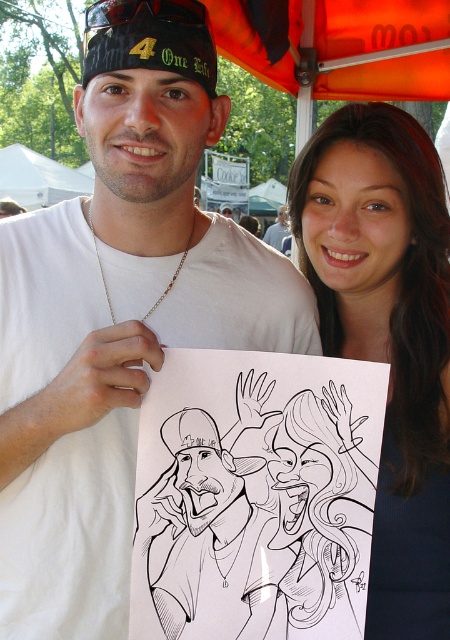
Which of these two, white matte t-shirt at center or orange fabric canopy at upper center, stands shorter?

With less height is orange fabric canopy at upper center.

How distant is white matte t-shirt at center from orange fabric canopy at upper center?

The distance of white matte t-shirt at center from orange fabric canopy at upper center is 4.80 feet.

At what (x,y) coordinates should I click in order to perform the action: click on white matte t-shirt at center. Please return your answer as a coordinate pair (x, y). Looking at the image, I should click on (117, 314).

Identify the location of white matte t-shirt at center. (117, 314).

Is black line drawing at center smaller than orange fabric canopy at upper center?

Correct, black line drawing at center occupies less space than orange fabric canopy at upper center.

How far apart are black line drawing at center and orange fabric canopy at upper center?

The distance of black line drawing at center from orange fabric canopy at upper center is 1.78 meters.

Between point (237, 620) and point (202, 1), which one is positioned behind?

The point (202, 1) is behind.

Locate an element on the screen. Image resolution: width=450 pixels, height=640 pixels. black line drawing at center is located at coordinates (256, 496).

Does white matte t-shirt at center have a smaller size compared to smooth dark hair at center?

Actually, white matte t-shirt at center might be larger than smooth dark hair at center.

What do you see at coordinates (117, 314) in the screenshot? I see `white matte t-shirt at center` at bounding box center [117, 314].

Locate an element on the screen. The image size is (450, 640). white matte t-shirt at center is located at coordinates (117, 314).